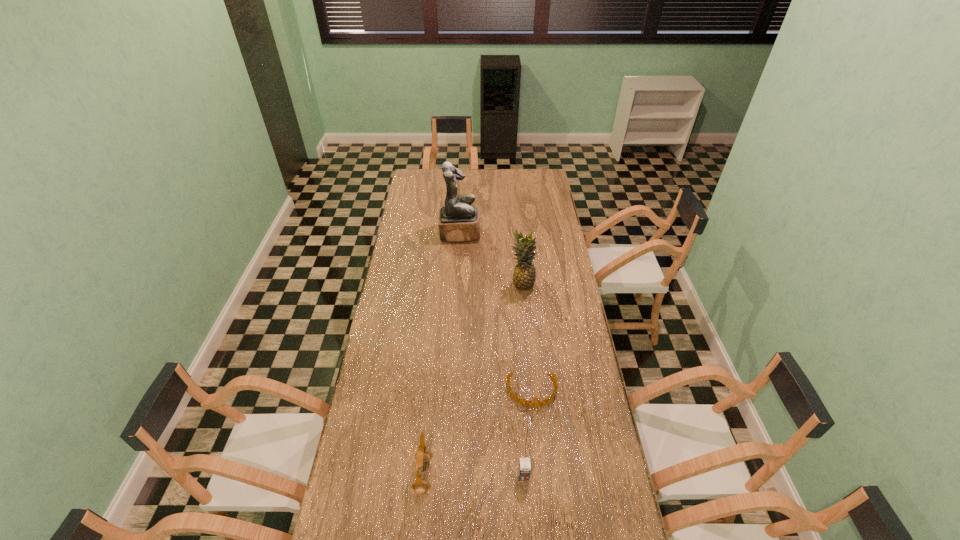
The width and height of the screenshot is (960, 540). I want to click on free space in the image that satisfies the following two spatial constraints: 1. on the front-facing side of the third nearest object; 2. on the front-facing side of the earphone, so click(540, 475).